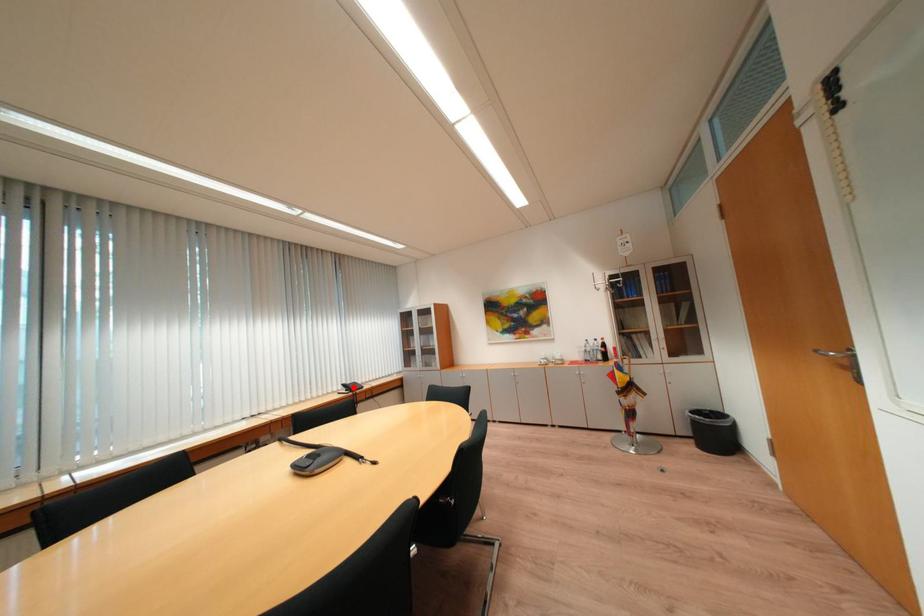
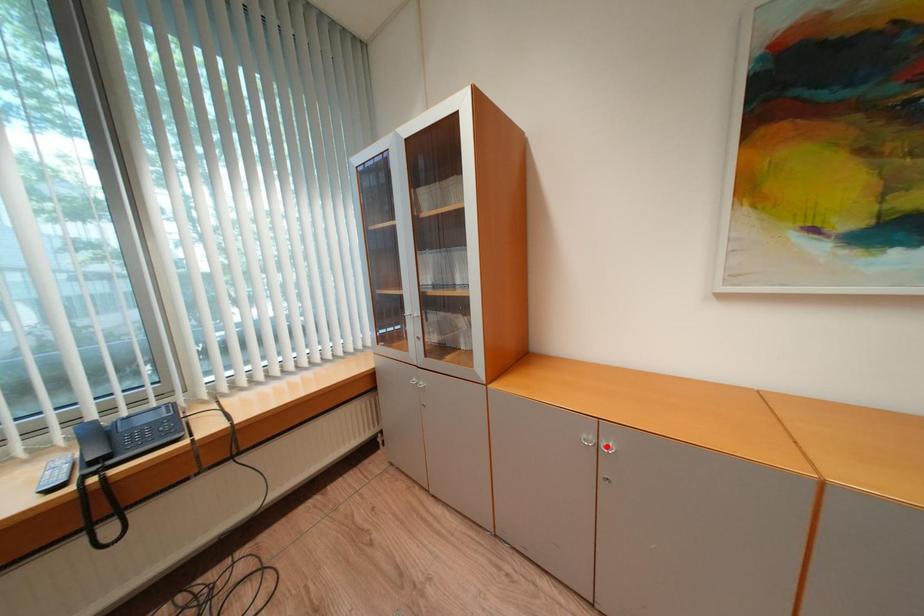
I am providing you with two images of the same scene from different viewpoints. A red point is marked on the first image and another point is marked on the second image. Are the points marked in image1 and image2 representing the same 3D position?

No